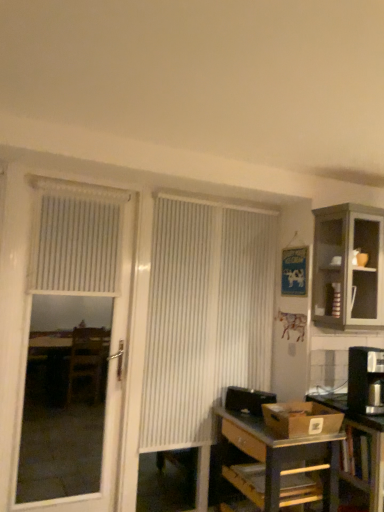
Question: Would you say white textured blind at upper left is to the left or to the right of metallic silver table at lower right in the picture?

Choices:
 (A) right
 (B) left

Answer: (B)

Question: From the image's perspective, is white textured blind at upper left above or below metallic silver table at lower right?

Choices:
 (A) above
 (B) below

Answer: (A)

Question: Considering the real-world distances, which object is farthest from the white vertical blinds at center?

Choices:
 (A) matte gray cabinet at upper right
 (B) metallic silver table at lower right
 (C) black plastic coffee maker at right
 (D) white textured screen door at left
 (E) metallic gray desk at lower right

Answer: (D)

Question: Which object is positioned closest to the black plastic coffee maker at right?

Choices:
 (A) white textured screen door at left
 (B) metallic silver table at lower right
 (C) metallic gray desk at lower right
 (D) white textured blind at upper left
 (E) matte gray cabinet at upper right

Answer: (B)